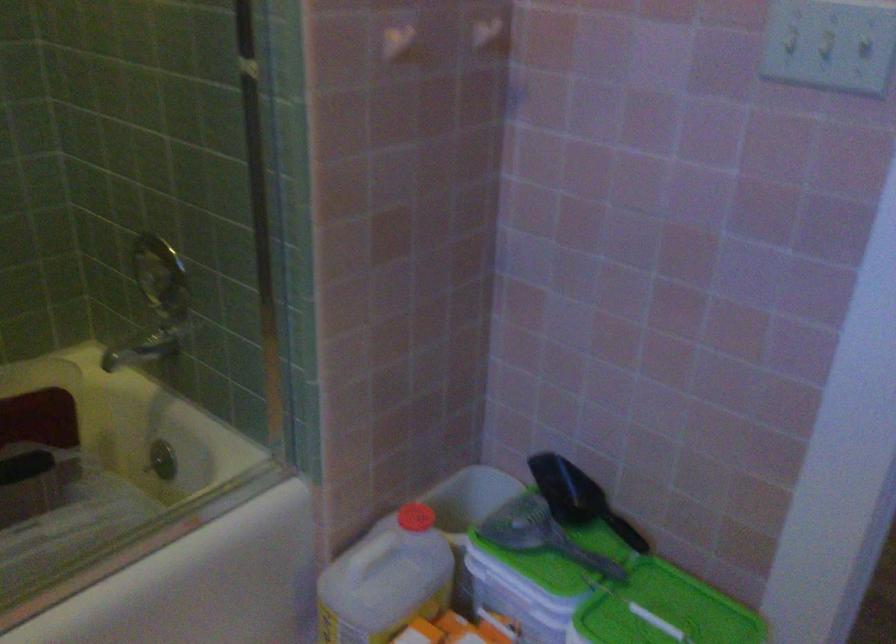
Find where to lift the green lid handle. Please return your answer as a coordinate pair (x, y).

(656, 621)